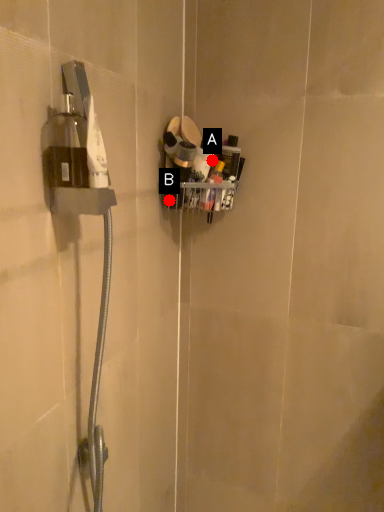
Question: Two points are circled on the image, labeled by A and B beside each circle. Which point is farther to the camera?

Choices:
 (A) A is further
 (B) B is further

Answer: (B)